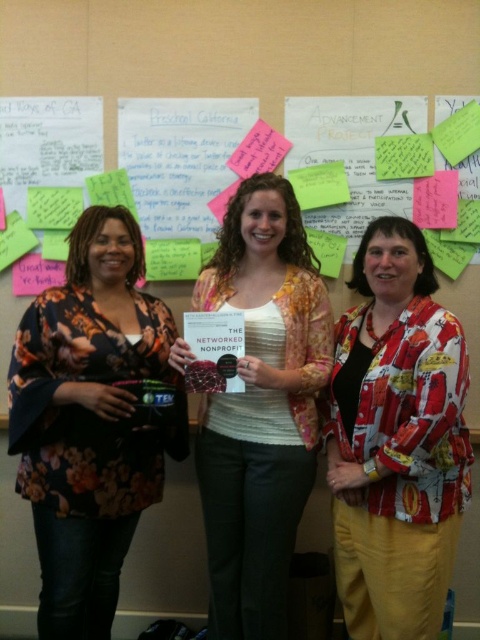
You are standing in front of the wall with papers and sticky notes. You want to reach a point that is 1.63 meters away from you. Is the point at coordinate point (391,452) within your reach if you can extend your arm 1.5 meters?

The point at coordinate point (391,452) is 1.63 meters away from you. Since your arm can only extend 1.5 meters, you cannot reach it.

You are standing in front of the wall with papers and sticky notes. There are two points marked on the wall at coordinates point (x=46, y=577) and point (x=359, y=481). If you want to place a new sticky note closer to the viewer, which coordinate should you choose?

You should choose point (x=46, y=577) because it is further to the viewer than point (x=359, y=481).